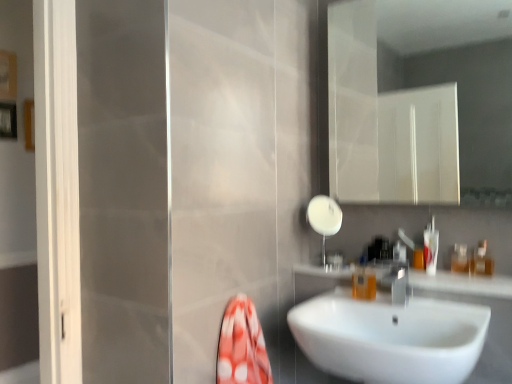
Question: Does white glossy shower at upper center have a greater width compared to translucent plastic container at right, marked as the second toiletry in a right-to-left arrangement?

Choices:
 (A) yes
 (B) no

Answer: (A)

Question: From the image's perspective, would you say white glossy shower at upper center is positioned over translucent plastic container at right, marked as the second toiletry in a right-to-left arrangement?

Choices:
 (A) yes
 (B) no

Answer: (A)

Question: Is the position of white glossy shower at upper center more distant than that of translucent plastic container at right, arranged as the second toiletry when viewed from the left?

Choices:
 (A) no
 (B) yes

Answer: (B)

Question: Can we say white glossy shower at upper center lies outside translucent plastic container at right, arranged as the second toiletry when viewed from the left?

Choices:
 (A) no
 (B) yes

Answer: (B)

Question: Is there a large distance between white glossy shower at upper center and translucent plastic container at right, arranged as the second toiletry when viewed from the left?

Choices:
 (A) no
 (B) yes

Answer: (A)

Question: Is white glossy shower at upper center facing away from translucent plastic container at right, arranged as the second toiletry when viewed from the left?

Choices:
 (A) yes
 (B) no

Answer: (B)

Question: Is silver metallic tap at sink right to the right of white glossy sink at center from the viewer's perspective?

Choices:
 (A) yes
 (B) no

Answer: (A)

Question: Does silver metallic tap at sink right have a larger size compared to white glossy sink at center?

Choices:
 (A) yes
 (B) no

Answer: (B)

Question: Considering the relative sizes of silver metallic tap at sink right and white glossy sink at center in the image provided, is silver metallic tap at sink right wider than white glossy sink at center?

Choices:
 (A) yes
 (B) no

Answer: (B)

Question: Is silver metallic tap at sink right in front of white glossy sink at center?

Choices:
 (A) no
 (B) yes

Answer: (A)

Question: Is silver metallic tap at sink right oriented towards white glossy sink at center?

Choices:
 (A) yes
 (B) no

Answer: (B)

Question: Is silver metallic tap at sink right not near white glossy sink at center?

Choices:
 (A) no
 (B) yes

Answer: (A)

Question: From a real-world perspective, is translucent plastic bottle at right, the 1th toiletry in the left-to-right sequence, on white glossy sink at center?

Choices:
 (A) no
 (B) yes

Answer: (B)